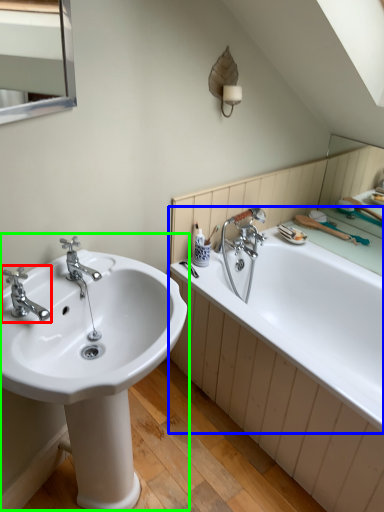
Question: Based on their relative distances, which object is farther from tap (highlighted by a red box)? Choose from bathtub (highlighted by a blue box) and sink (highlighted by a green box).

Choices:
 (A) bathtub
 (B) sink

Answer: (A)